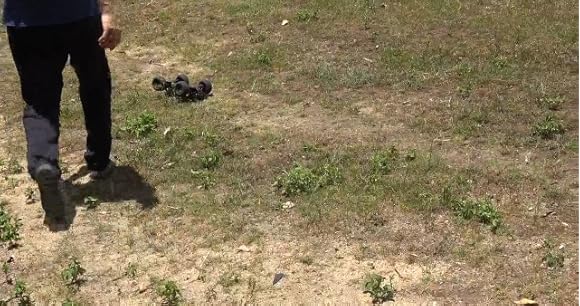
Where is `toy car wheels`? toy car wheels is located at coordinates (181, 76), (206, 85), (183, 89), (159, 82).